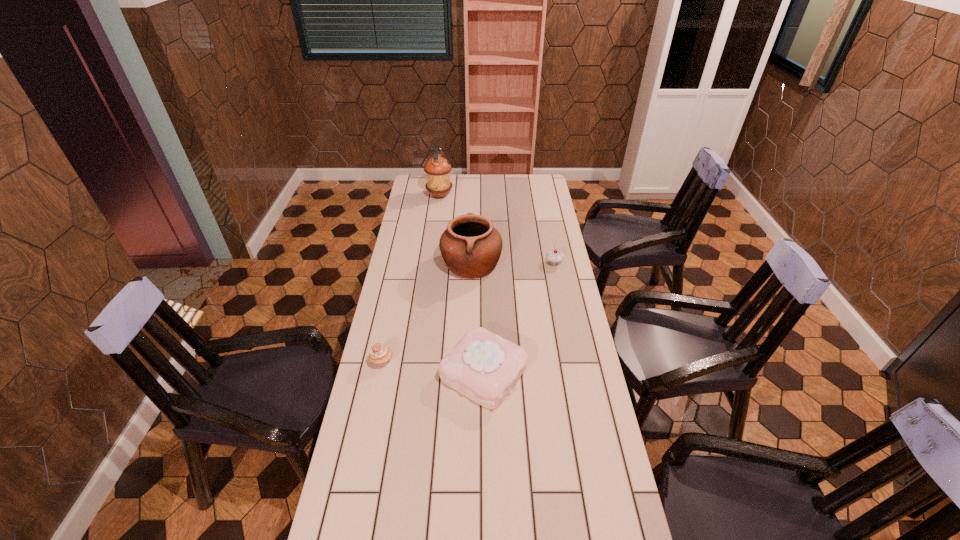
At what (x,y) coordinates should I click in order to perform the action: click on blank space at the right edge of the desktop. Please return your answer as a coordinate pair (x, y). Image resolution: width=960 pixels, height=540 pixels. Looking at the image, I should click on (573, 365).

Where is `free space that is in between the second tallest object and the left cupcake`? free space that is in between the second tallest object and the left cupcake is located at coordinates coord(426,313).

Find the location of a particular element. This screenshot has height=540, width=960. free space between the leftmost object and the farther cupcake is located at coordinates (468, 312).

Locate an element on the screen. The width and height of the screenshot is (960, 540). vacant space in between the cake and the fourth shortest object is located at coordinates (478, 319).

This screenshot has width=960, height=540. Find the location of `free spot between the leftmost object and the pottery`. free spot between the leftmost object and the pottery is located at coordinates (426, 313).

At what (x,y) coordinates should I click in order to perform the action: click on the fourth closest object to the cake. Please return your answer as a coordinate pair (x, y). Looking at the image, I should click on (437, 168).

Find the location of a particular element. object that is the closest to the right cupcake is located at coordinates (471, 247).

Locate an element on the screen. Image resolution: width=960 pixels, height=540 pixels. vacant space that satisfies the following two spatial constraints: 1. on the front side of the nearer cupcake; 2. on the right side of the cake is located at coordinates 379,373.